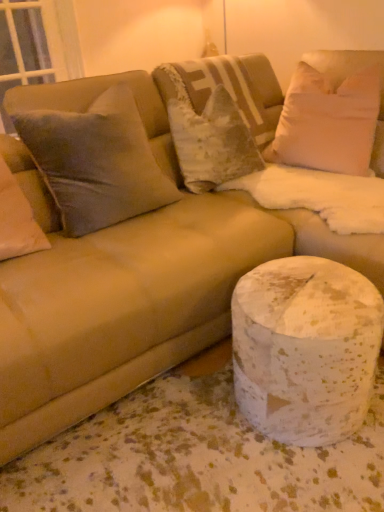
Question: Considering the positions of white speckled marble at lower right and white soft pillow at upper right, the 1th pillow positioned from the right, in the image, is white speckled marble at lower right bigger or smaller than white soft pillow at upper right, the 1th pillow positioned from the right,?

Choices:
 (A) small
 (B) big

Answer: (A)

Question: Looking at their shapes, would you say white speckled marble at lower right is wider or thinner than white soft pillow at upper right, the 5th pillow in the left-to-right sequence?

Choices:
 (A) wide
 (B) thin

Answer: (A)

Question: Based on their relative distances, which object is farther from the suede pillow at left, which is the first pillow from left to right?

Choices:
 (A) transparent glass window screen at upper left
 (B) white speckled marble at lower right
 (C) velvet beige pillow at center, placed as the third pillow when sorted from right to left
 (D) velvet textured pillow at center, acting as the 4th pillow starting from the left
 (E) velvet gray pillow at upper left, which ranks as the 4th pillow in right-to-left order

Answer: (A)

Question: Which object is positioned farthest from the white soft pillow at upper right, the 1th pillow positioned from the right?

Choices:
 (A) white speckled marble at lower right
 (B) transparent glass window screen at upper left
 (C) velvet textured pillow at center, acting as the 4th pillow starting from the left
 (D) velvet gray pillow at upper left, acting as the 2th pillow starting from the left
 (E) suede pillow at left, which is counted as the fifth pillow, starting from the right

Answer: (B)